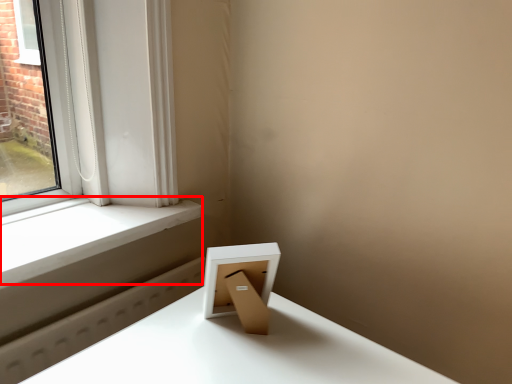
Question: From the image's perspective, considering the relative positions of window sill (annotated by the red box) and picture frame in the image provided, where is window sill (annotated by the red box) located with respect to the staircase?

Choices:
 (A) above
 (B) below

Answer: (A)